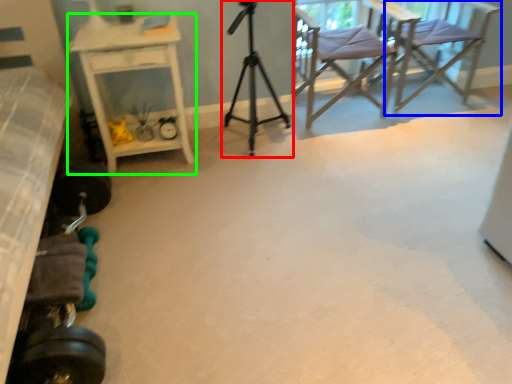
Question: Which is farther away from tripod (highlighted by a red box)? chair (highlighted by a blue box) or desk (highlighted by a green box)?

Choices:
 (A) chair
 (B) desk

Answer: (A)